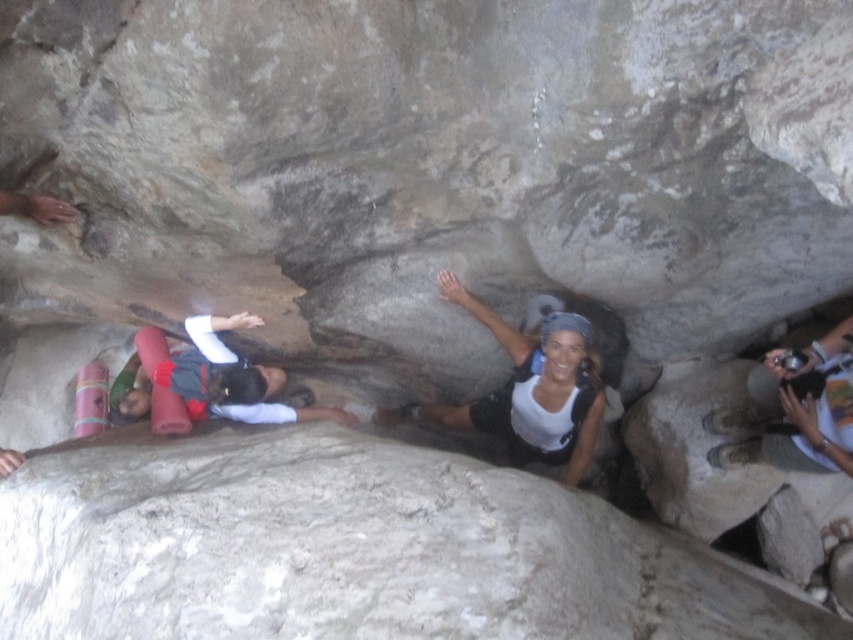
Describe the element at coordinates (527, 390) in the screenshot. I see `white matte tank top at center` at that location.

Between white matte tank top at center and white fabric camera at right, which one appears on the left side from the viewer's perspective?

white matte tank top at center is more to the left.

Is point (549, 369) behind point (822, 404)?

Yes, point (549, 369) is farther from viewer.

Where is `white matte tank top at center`? The image size is (853, 640). white matte tank top at center is located at coordinates (527, 390).